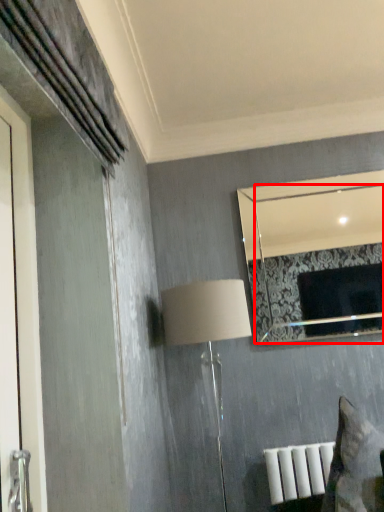
Question: From the image, what is the correct spatial relationship of mirror (annotated by the red box) in relation to table lamp?

Choices:
 (A) right
 (B) left

Answer: (A)